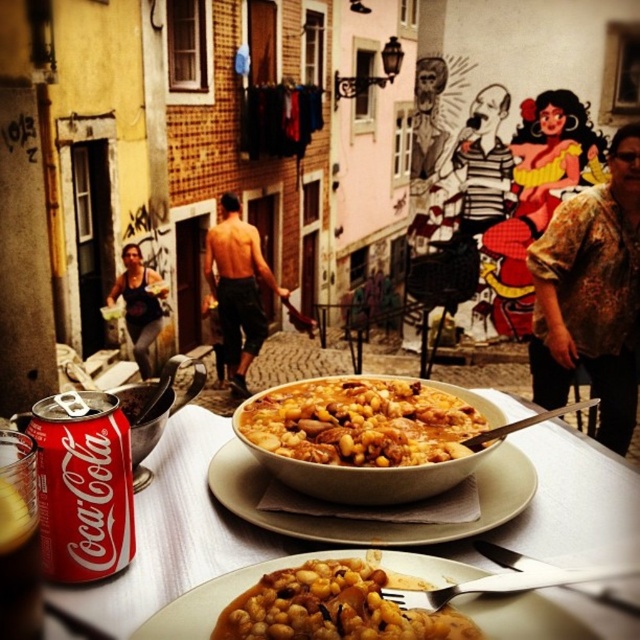
Question: Which of the following is the farthest from the observer?

Choices:
 (A) white ceramic bowl at center
 (B) red matte coca-cola can at lower left

Answer: (A)

Question: Which point is farther from the camera taking this photo?

Choices:
 (A) (141, 300)
 (B) (211, 484)
 (C) (586, 310)
 (D) (422, 419)

Answer: (A)

Question: Among these objects, which one is farthest from the camera?

Choices:
 (A) matte brown beans at center
 (B) coca-cola can at lower left
 (C) red matte coca-cola can at lower left

Answer: (B)

Question: Can you confirm if printed silk blouse at right is positioned to the right of matte brown beans at center?

Choices:
 (A) yes
 (B) no

Answer: (A)

Question: Does printed silk blouse at right have a larger size compared to matte brown beans at center?

Choices:
 (A) yes
 (B) no

Answer: (A)

Question: Is red matte coca-cola can at lower left closer to camera compared to shiny black shorts at center?

Choices:
 (A) yes
 (B) no

Answer: (A)